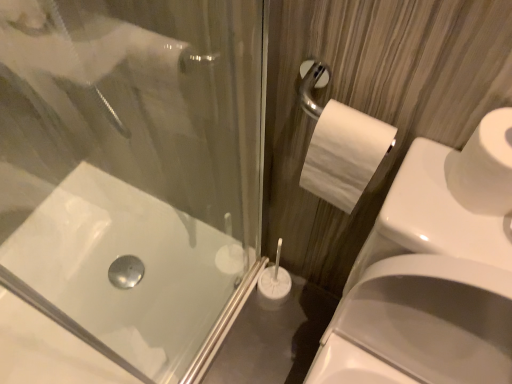
Identify the location of free point in front of white matte toilet paper at right, the 1th toilet paper in the right-to-left sequence. This screenshot has width=512, height=384. (471, 244).